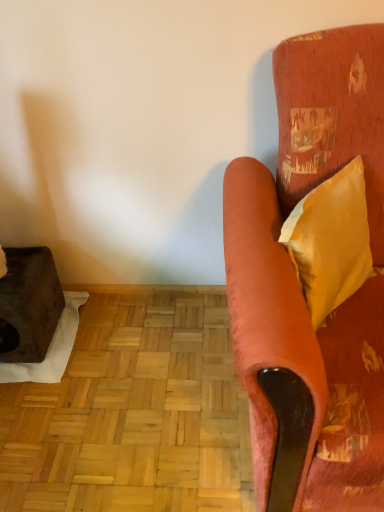
Find the location of `velvet orange couch at right`. velvet orange couch at right is located at coordinates (298, 282).

What do you see at coordinates (298, 282) in the screenshot? I see `velvet orange couch at right` at bounding box center [298, 282].

In order to click on yellow satin pillow at right in this screenshot , I will do `click(330, 241)`.

Measure the distance between point (363, 183) and camera.

They are 1.13 meters apart.

Describe the element at coordinates (330, 241) in the screenshot. I see `yellow satin pillow at right` at that location.

Find the location of a particular element. This screenshot has width=384, height=512. velvet orange couch at right is located at coordinates (298, 282).

Can you confirm if yellow satin pillow at right is positioned to the left of velvet orange couch at right?

Correct, you'll find yellow satin pillow at right to the left of velvet orange couch at right.

Considering the relative positions of yellow satin pillow at right and velvet orange couch at right in the image provided, is yellow satin pillow at right behind velvet orange couch at right?

Yes.

Which point is more forward, (304, 268) or (228, 262)?

The point (228, 262) is more forward.

From the image's perspective, does yellow satin pillow at right appear higher than velvet orange couch at right?

Indeed, from the image's perspective, yellow satin pillow at right is shown above velvet orange couch at right.

From a real-world perspective, which is physically above, yellow satin pillow at right or velvet orange couch at right?

In real-world perspective, yellow satin pillow at right is above.

In the scene shown: Between yellow satin pillow at right and velvet orange couch at right, which one has larger width?

velvet orange couch at right is wider.

Who is shorter, yellow satin pillow at right or velvet orange couch at right?

With less height is yellow satin pillow at right.

Between yellow satin pillow at right and velvet orange couch at right, which one has smaller size?

yellow satin pillow at right is smaller.

Is yellow satin pillow at right outside of velvet orange couch at right?

No, yellow satin pillow at right is inside velvet orange couch at right's boundary.

Is yellow satin pillow at right not near velvet orange couch at right?

yellow satin pillow at right is near velvet orange couch at right, not far away.

Could you tell me if yellow satin pillow at right is turned towards velvet orange couch at right?

Yes, yellow satin pillow at right faces towards velvet orange couch at right.

Locate an element on the screen. The image size is (384, 512). studio couch on the right of the yellow satin pillow at right is located at coordinates (298, 282).

Considering the positions of objects velvet orange couch at right and yellow satin pillow at right in the image provided, who is more to the left, velvet orange couch at right or yellow satin pillow at right?

yellow satin pillow at right.

Is velvet orange couch at right further to the viewer compared to yellow satin pillow at right?

No, velvet orange couch at right is closer to the camera.

Is point (258, 504) behind point (327, 263)?

Yes, it is behind point (327, 263).

From the image's perspective, is velvet orange couch at right located above or below yellow satin pillow at right?

Clearly, from the image's perspective, velvet orange couch at right is below yellow satin pillow at right.

From a real-world perspective, is velvet orange couch at right below yellow satin pillow at right?

Yes.

Which object is wider, velvet orange couch at right or yellow satin pillow at right?

velvet orange couch at right is wider.

From their relative heights in the image, would you say velvet orange couch at right is taller or shorter than yellow satin pillow at right?

Considering their sizes, velvet orange couch at right has more height than yellow satin pillow at right.

From the picture: Which of these two, velvet orange couch at right or yellow satin pillow at right, is smaller?

yellow satin pillow at right.

Is yellow satin pillow at right inside velvet orange couch at right?

That's correct, yellow satin pillow at right is inside velvet orange couch at right.

Is velvet orange couch at right touching yellow satin pillow at right?

velvet orange couch at right is not next to yellow satin pillow at right, and they're not touching.

Is velvet orange couch at right facing away from yellow satin pillow at right?

Yes, yellow satin pillow at right is at the back of velvet orange couch at right.

How distant is velvet orange couch at right from yellow satin pillow at right?

velvet orange couch at right and yellow satin pillow at right are 14.01 centimeters apart.

This screenshot has height=512, width=384. Identify the location of studio couch below the yellow satin pillow at right (from the image's perspective). (298, 282).

Identify the location of studio couch below the yellow satin pillow at right (from the image's perspective). The image size is (384, 512). (298, 282).

This screenshot has height=512, width=384. In order to click on pillow located above the velvet orange couch at right (from the image's perspective) in this screenshot , I will do `click(330, 241)`.